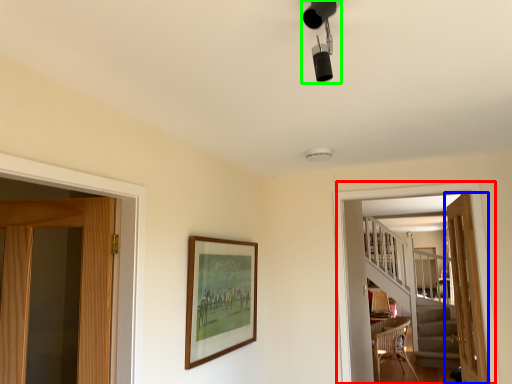
Question: Considering the real-world distances, which object is farthest from screen door (highlighted by a red box)? door (highlighted by a blue box) or light fixture (highlighted by a green box)?

Choices:
 (A) door
 (B) light fixture

Answer: (B)